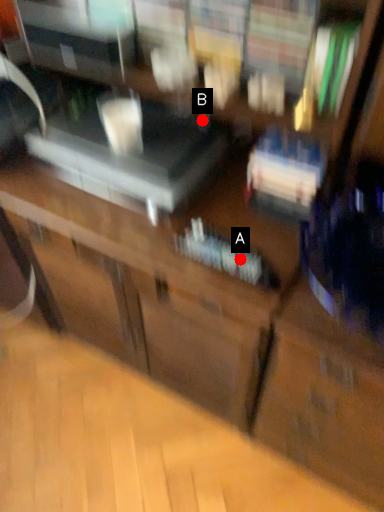
Question: Two points are circled on the image, labeled by A and B beside each circle. Which point appears closest to the camera in this image?

Choices:
 (A) A is closer
 (B) B is closer

Answer: (A)